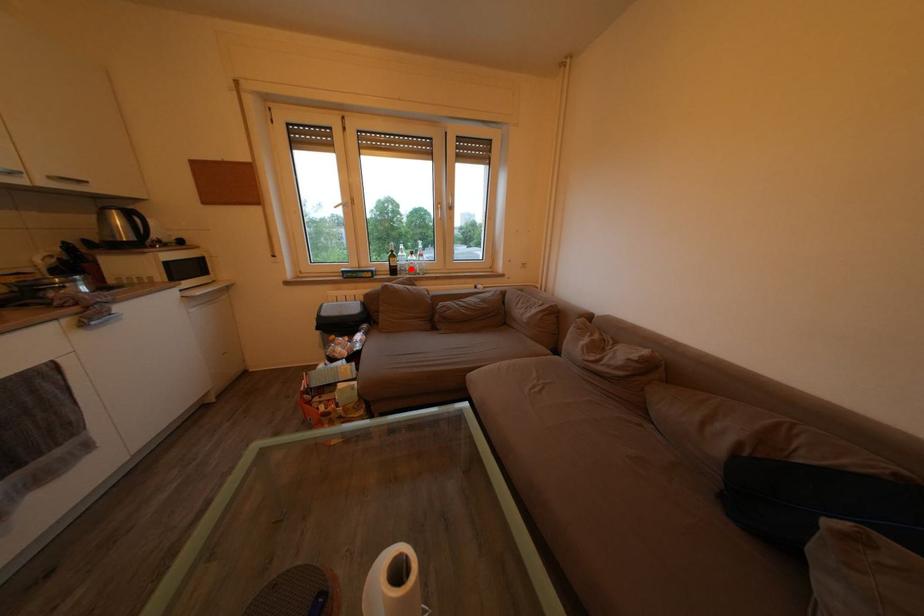
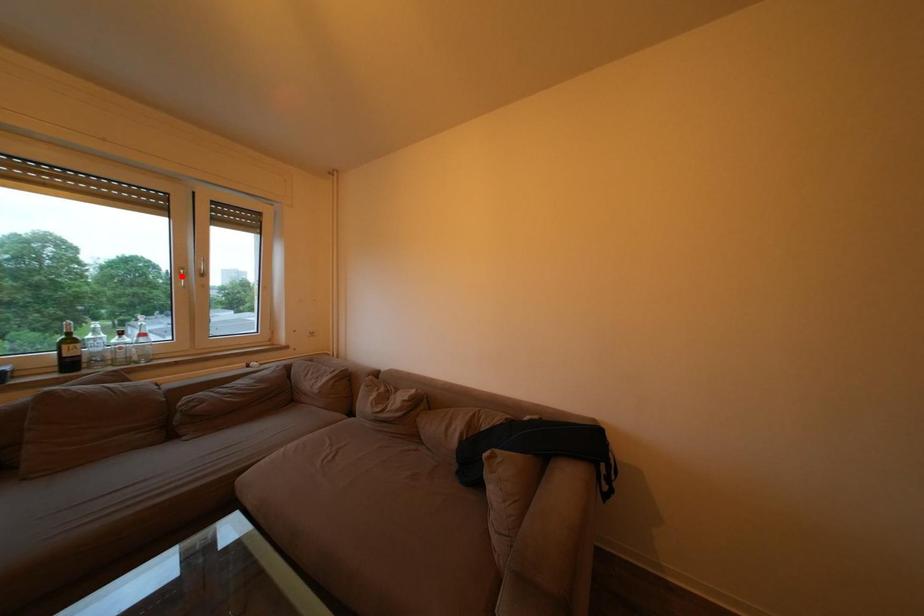
I am providing you with two images of the same scene from different viewpoints. A red point is marked on the first image and another point is marked on the second image. Are the points marked in image1 and image2 representing the same 3D position?

No